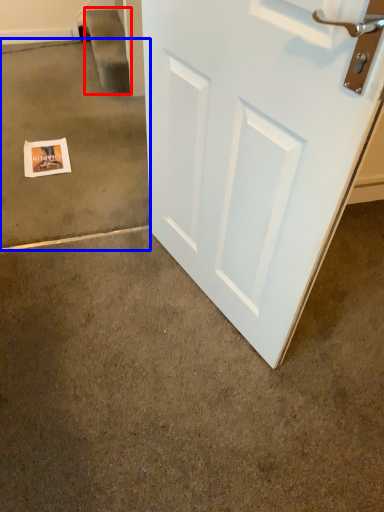
Question: Which object is closer to the camera taking this photo, stairwell (highlighted by a red box) or concrete (highlighted by a blue box)?

Choices:
 (A) stairwell
 (B) concrete

Answer: (B)